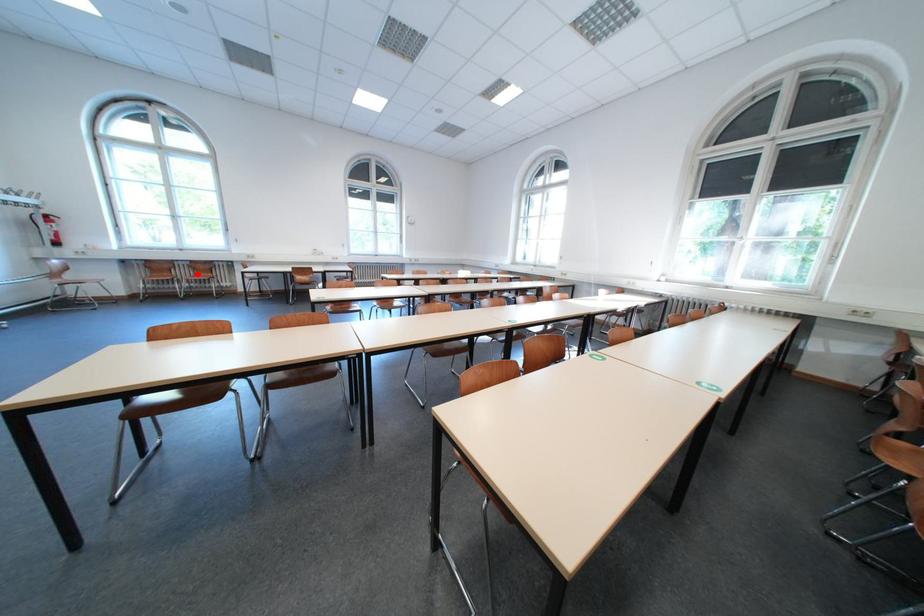
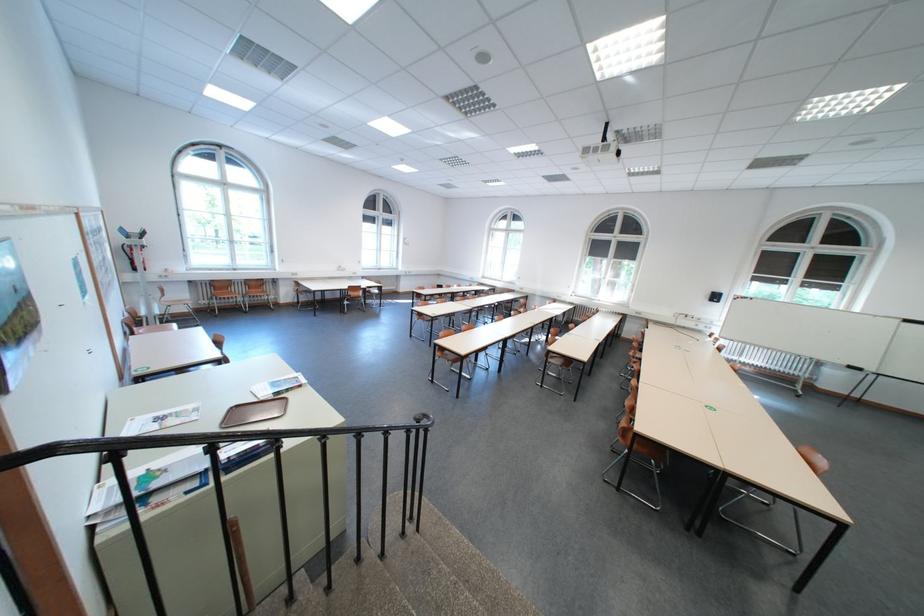
In the second image, find the point that corresponds to the highlighted location in the first image.

(252, 291)